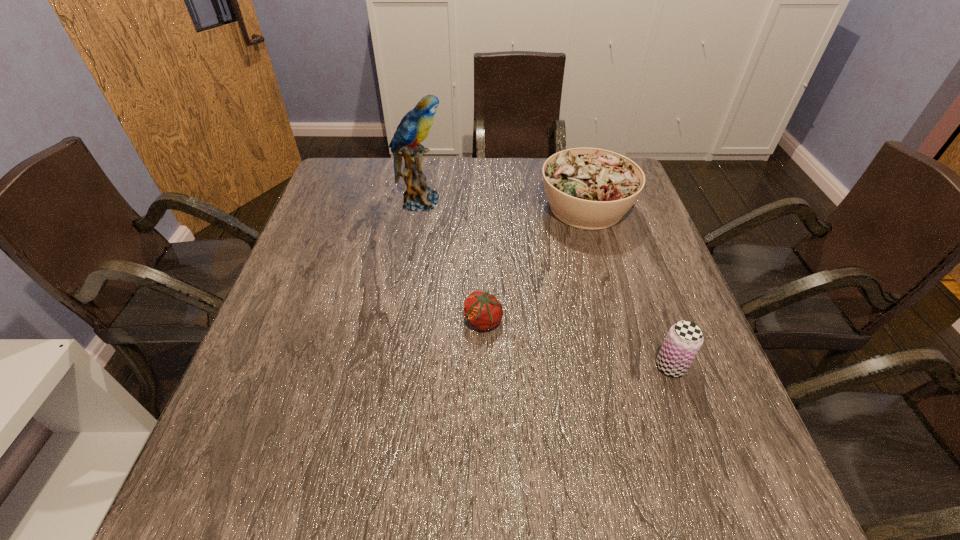
Image resolution: width=960 pixels, height=540 pixels. I want to click on parrot that is at the far edge, so click(x=414, y=127).

Locate an element on the screen. This screenshot has width=960, height=540. salad that is at the far edge is located at coordinates (587, 188).

I want to click on salad positioned at the right edge, so click(587, 188).

Where is `beer can situated at the right edge`? beer can situated at the right edge is located at coordinates (684, 339).

This screenshot has height=540, width=960. Find the location of `object present at the far right corner`. object present at the far right corner is located at coordinates (587, 188).

This screenshot has width=960, height=540. I want to click on vacant region at the far edge of the desktop, so click(443, 180).

I want to click on vacant space at the near edge of the desktop, so click(487, 497).

The height and width of the screenshot is (540, 960). Identify the location of vacant region at the left edge. (287, 285).

The image size is (960, 540). In the image, there is a desktop. Find the location of `vacant area at the right edge`. vacant area at the right edge is located at coordinates (634, 330).

Where is `vacant space at the far left corner of the desktop`? The image size is (960, 540). vacant space at the far left corner of the desktop is located at coordinates (355, 198).